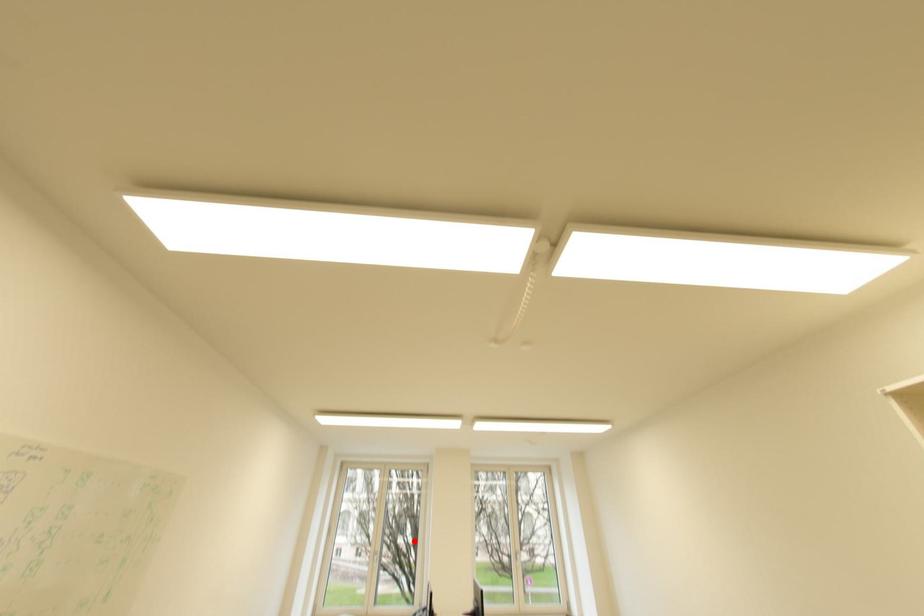
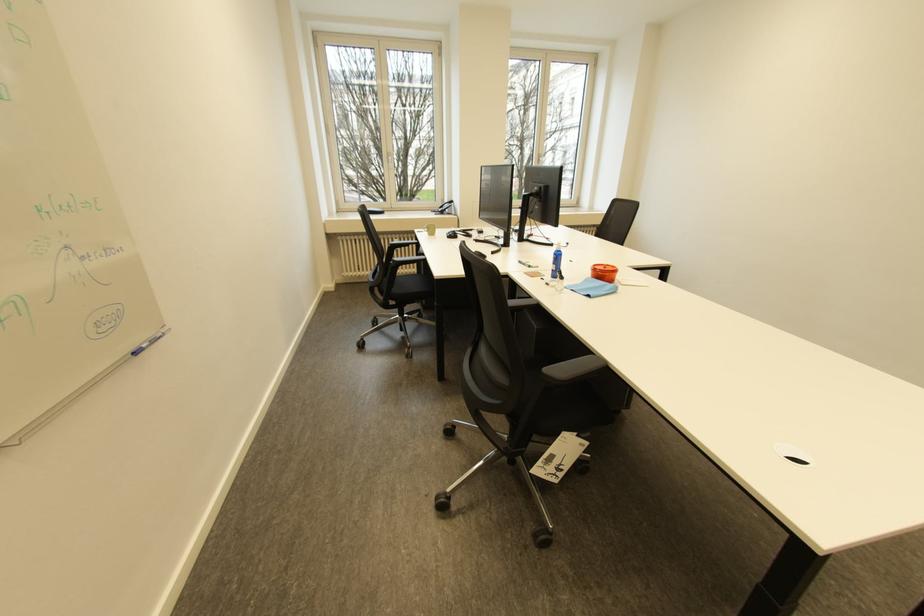
Where in the second image is the point corresponding to the highlighted location from the first image?

(386, 171)